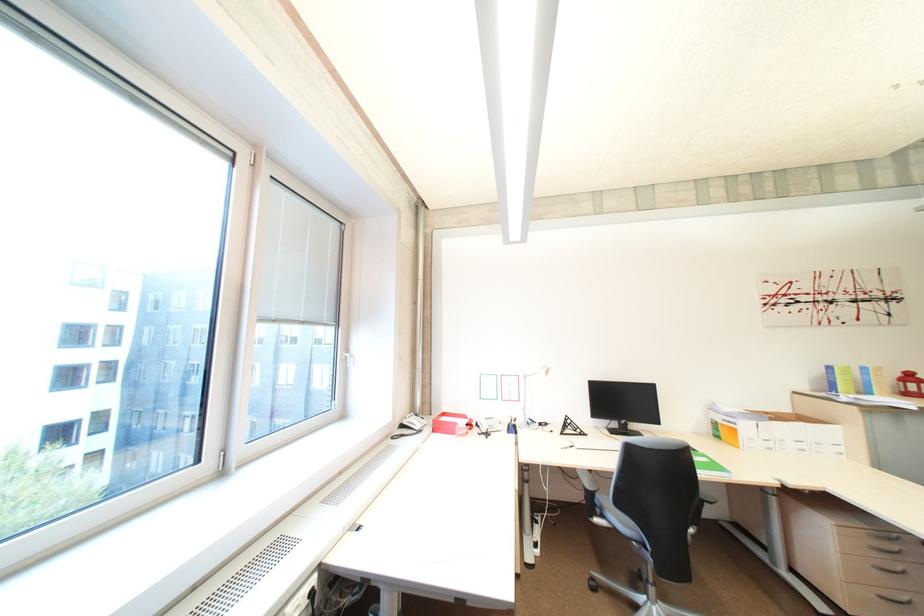
What do you see at coordinates (412, 424) in the screenshot? I see `the white telephone handset` at bounding box center [412, 424].